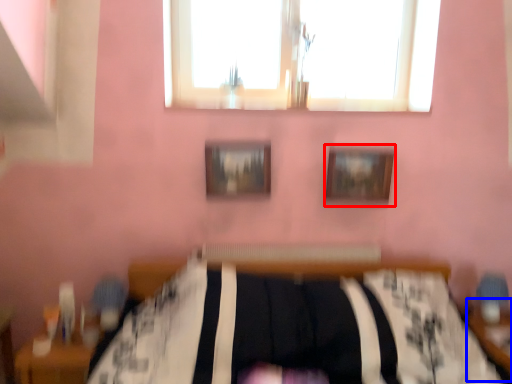
Question: Among these objects, which one is nearest to the camera, picture frame (highlighted by a red box) or table (highlighted by a blue box)?

Choices:
 (A) picture frame
 (B) table

Answer: (B)